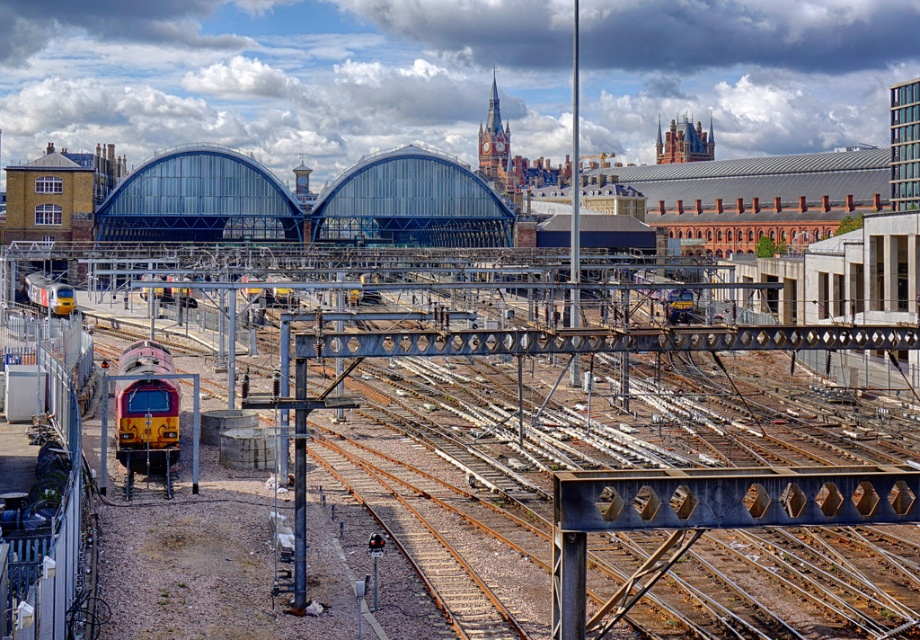
Can you confirm if yellow and purple locomotive at center is thinner than yellow metallic train at left?

Indeed, yellow and purple locomotive at center has a lesser width compared to yellow metallic train at left.

Between yellow and purple locomotive at center and yellow metallic train at left, which one has less height?

yellow metallic train at left

Where is `yellow and purple locomotive at center`? The height and width of the screenshot is (640, 920). yellow and purple locomotive at center is located at coordinates (146, 408).